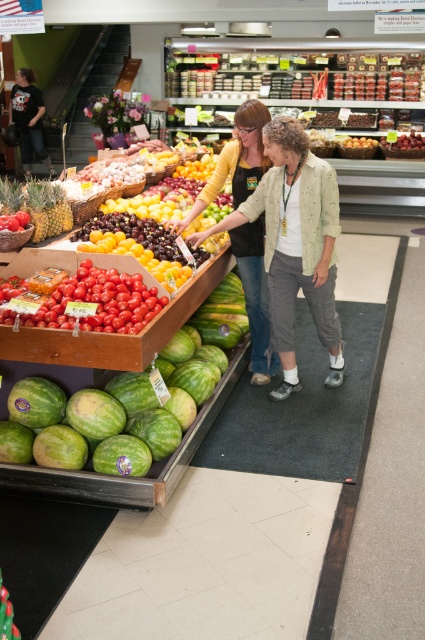
Question: Which point appears closest to the camera in this image?

Choices:
 (A) (280, 346)
 (B) (382, 144)
 (C) (108, 269)

Answer: (C)

Question: Can you confirm if light green textured jacket at center is positioned above red matte tomatoes at center?

Choices:
 (A) no
 (B) yes

Answer: (B)

Question: Which point is farther to the camera?

Choices:
 (A) (156, 273)
 (B) (396, 138)
 (C) (334, 340)

Answer: (B)

Question: Is red matte tomatoes at center wider than glossy yellow plums at center?

Choices:
 (A) no
 (B) yes

Answer: (B)

Question: Is green matte watermelon at lower left below red matte tomatoes at center?

Choices:
 (A) yes
 (B) no

Answer: (B)

Question: Among these points, which one is farthest from the camera?

Choices:
 (A) (76, 284)
 (B) (295, 282)

Answer: (B)